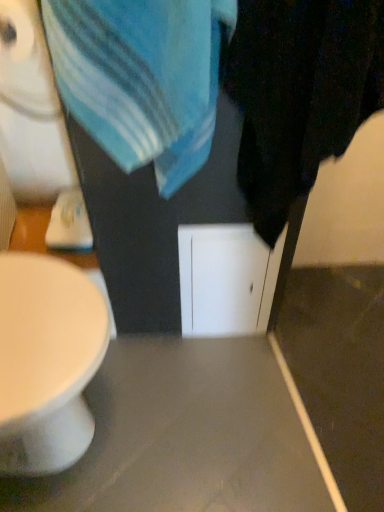
Question: Is blue cotton towel at upper center positioned far away from white paper at upper left?

Choices:
 (A) yes
 (B) no

Answer: (B)

Question: From a real-world perspective, is blue cotton towel at upper center positioned over white paper at upper left based on gravity?

Choices:
 (A) yes
 (B) no

Answer: (B)

Question: From the image's perspective, is blue cotton towel at upper center under white paper at upper left?

Choices:
 (A) no
 (B) yes

Answer: (B)

Question: Is white paper at upper left completely or partially inside blue cotton towel at upper center?

Choices:
 (A) no
 (B) yes

Answer: (A)

Question: Can you confirm if blue cotton towel at upper center is smaller than white paper at upper left?

Choices:
 (A) no
 (B) yes

Answer: (A)

Question: Considering the relative sizes of blue cotton towel at upper center and white paper at upper left in the image provided, is blue cotton towel at upper center bigger than white paper at upper left?

Choices:
 (A) yes
 (B) no

Answer: (A)

Question: From a real-world perspective, is white paper at upper left below blue cotton towel at upper center?

Choices:
 (A) yes
 (B) no

Answer: (B)

Question: Is white paper at upper left oriented away from blue cotton towel at upper center?

Choices:
 (A) no
 (B) yes

Answer: (A)

Question: Is white paper at upper left far away from blue cotton towel at upper center?

Choices:
 (A) no
 (B) yes

Answer: (A)

Question: Is white paper at upper left wider than blue cotton towel at upper center?

Choices:
 (A) no
 (B) yes

Answer: (A)

Question: From the image's perspective, would you say white paper at upper left is shown under blue cotton towel at upper center?

Choices:
 (A) yes
 (B) no

Answer: (B)

Question: Is white paper at upper left shorter than blue cotton towel at upper center?

Choices:
 (A) no
 (B) yes

Answer: (B)

Question: Does white paper at upper left come in front of matte gray table at center?

Choices:
 (A) yes
 (B) no

Answer: (A)